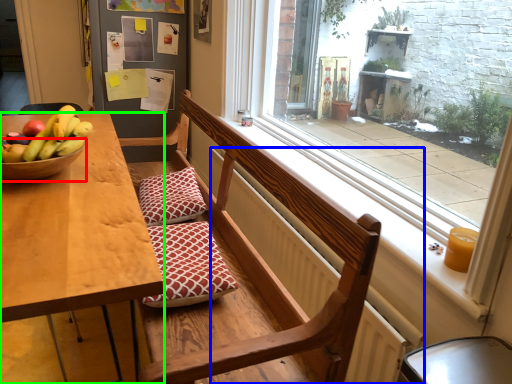
Question: Based on their relative distances, which object is nearer to glass bowl (highlighted by a red box)? Choose from radiator (highlighted by a blue box) and kitchen & dining room table (highlighted by a green box).

Choices:
 (A) radiator
 (B) kitchen & dining room table

Answer: (B)